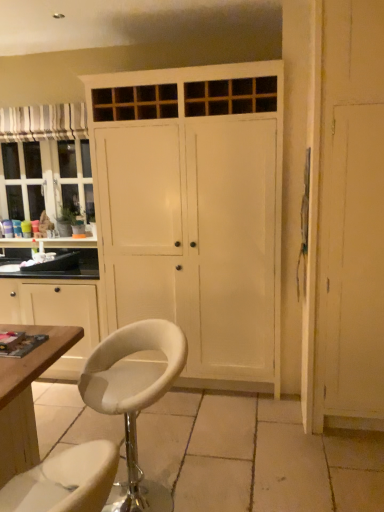
Question: Is striped fabric curtain at upper left wider than white painted wood cupboard at center?

Choices:
 (A) yes
 (B) no

Answer: (B)

Question: Can you confirm if striped fabric curtain at upper left is thinner than white painted wood cupboard at center?

Choices:
 (A) yes
 (B) no

Answer: (A)

Question: Can you confirm if striped fabric curtain at upper left is shorter than white painted wood cupboard at center?

Choices:
 (A) yes
 (B) no

Answer: (A)

Question: Could you tell me if striped fabric curtain at upper left is facing white painted wood cupboard at center?

Choices:
 (A) yes
 (B) no

Answer: (B)

Question: From the image's perspective, is striped fabric curtain at upper left on top of white painted wood cupboard at center?

Choices:
 (A) no
 (B) yes

Answer: (B)

Question: Is striped fabric curtain at upper left wider or thinner than white leather stool at center?

Choices:
 (A) wide
 (B) thin

Answer: (B)

Question: In terms of size, does striped fabric curtain at upper left appear bigger or smaller than white leather stool at center?

Choices:
 (A) big
 (B) small

Answer: (B)

Question: Visually, is striped fabric curtain at upper left positioned to the left or to the right of white leather stool at center?

Choices:
 (A) right
 (B) left

Answer: (B)

Question: In the image, is striped fabric curtain at upper left positioned in front of or behind white leather stool at center?

Choices:
 (A) behind
 (B) front

Answer: (A)

Question: In terms of width, does white leather stool at center look wider or thinner when compared to white painted wood cupboard at center?

Choices:
 (A) wide
 (B) thin

Answer: (B)

Question: From the image's perspective, is white leather stool at center located above or below white painted wood cupboard at center?

Choices:
 (A) below
 (B) above

Answer: (A)

Question: Considering the positions of point (148, 376) and point (215, 377), is point (148, 376) closer or farther from the camera than point (215, 377)?

Choices:
 (A) closer
 (B) farther

Answer: (A)

Question: Considering their positions, is white leather stool at center located in front of or behind white painted wood cupboard at center?

Choices:
 (A) front
 (B) behind

Answer: (A)

Question: Based on their sizes in the image, would you say white painted wood cupboard at center is bigger or smaller than wooden cabinet at left?

Choices:
 (A) small
 (B) big

Answer: (B)

Question: In the image, is white painted wood cupboard at center on the left side or the right side of wooden cabinet at left?

Choices:
 (A) right
 (B) left

Answer: (A)